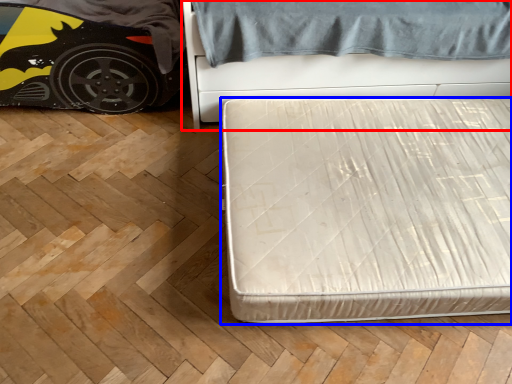
Question: Which of the following is the closest to the observer, bed (highlighted by a red box) or bed (highlighted by a blue box)?

Choices:
 (A) bed
 (B) bed

Answer: (B)